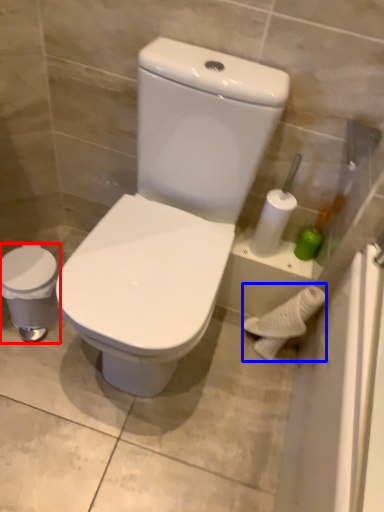
Question: Which of the following is the farthest to the observer, porcelain (highlighted by a red box) or porcelain (highlighted by a blue box)?

Choices:
 (A) porcelain
 (B) porcelain

Answer: (B)